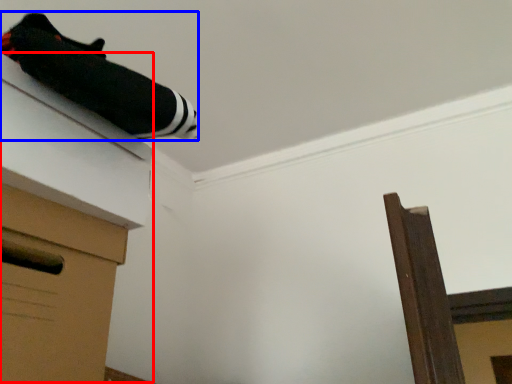
Question: Which object is further to the camera taking this photo, vanity (highlighted by a red box) or twin (highlighted by a blue box)?

Choices:
 (A) vanity
 (B) twin

Answer: (A)